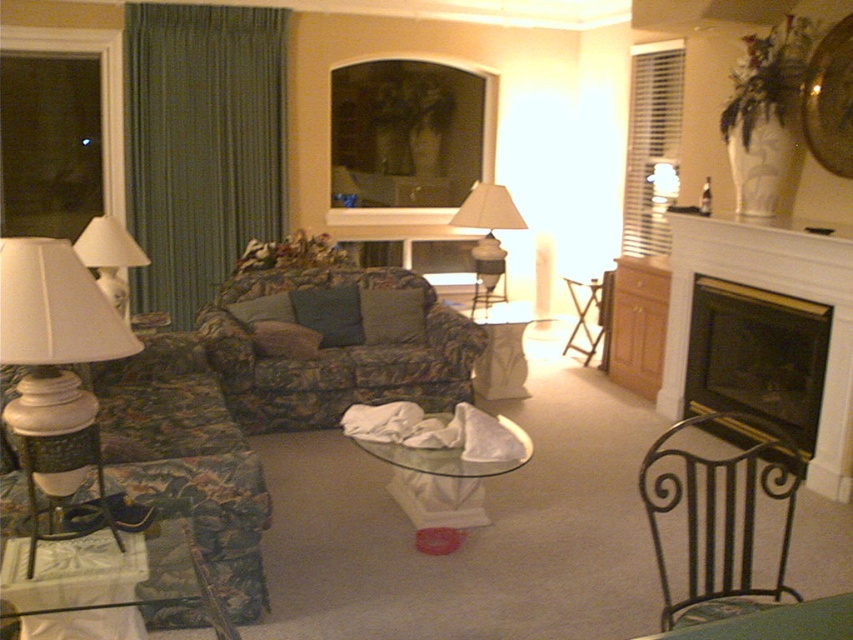
Question: In this image, where is iron/metallic armchair at lower right located relative to white painted wood fireplace at right?

Choices:
 (A) below
 (B) above

Answer: (A)

Question: Among these objects, which one is farthest from the camera?

Choices:
 (A) iron/metallic armchair at lower right
 (B) floral fabric couch at center
 (C) translucent glass table at center
 (D) floral fabric couch at left

Answer: (C)

Question: Among these objects, which one is nearest to the camera?

Choices:
 (A) transparent glass table at center
 (B) white glossy lampshade at left

Answer: (A)

Question: Which object is closer to the camera taking this photo?

Choices:
 (A) floral fabric couch at left
 (B) white painted wood fireplace at right
 (C) white glossy lampshade at left

Answer: (A)

Question: Does white painted wood fireplace at right have a smaller size compared to white matte lamp at left?

Choices:
 (A) yes
 (B) no

Answer: (B)

Question: From the image, what is the correct spatial relationship of white painted wood fireplace at right in relation to metallic black side table at lower left?

Choices:
 (A) right
 (B) left

Answer: (A)